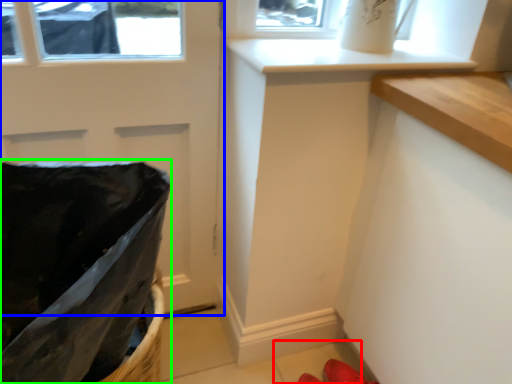
Question: Based on their relative distances, which object is nearer to tile (highlighted by a red box)? Choose from door (highlighted by a blue box) and laundry basket (highlighted by a green box).

Choices:
 (A) door
 (B) laundry basket

Answer: (A)